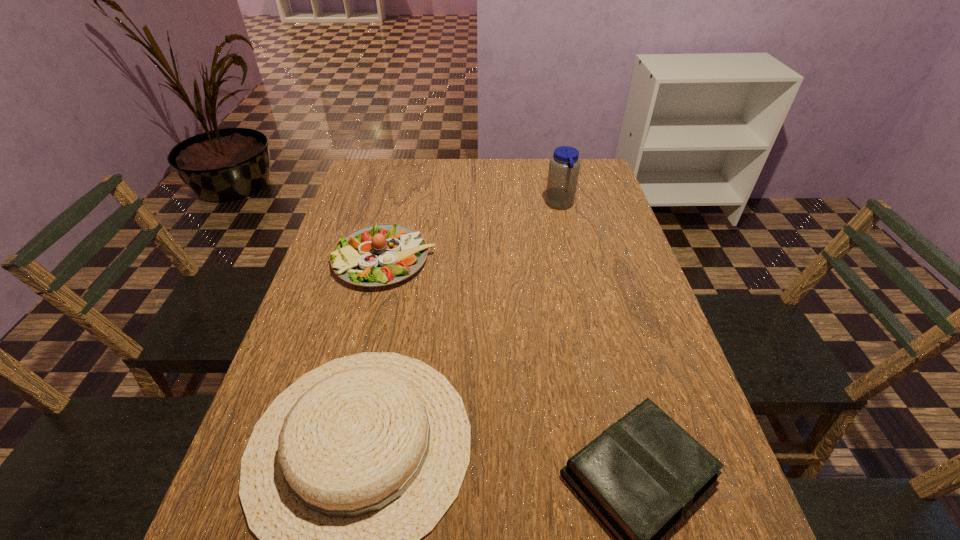
This screenshot has width=960, height=540. I want to click on free space at the left edge, so click(x=338, y=282).

You are a GUI agent. You are given a task and a screenshot of the screen. Output one action in this format:
    pyautogui.click(x=<x>, y=<y>)
    Task: Click on the vacant space at the right edge
    This screenshot has width=960, height=540.
    Given the screenshot: What is the action you would take?
    pyautogui.click(x=607, y=356)

Where is `free space at the far right corner`? This screenshot has height=540, width=960. free space at the far right corner is located at coordinates (605, 183).

You are a GUI agent. You are given a task and a screenshot of the screen. Output one action in this format:
    pyautogui.click(x=<x>, y=<y>)
    Task: Click on the free space between the water bottle and the second farthest object
    The height and width of the screenshot is (540, 960).
    Given the screenshot: What is the action you would take?
    pyautogui.click(x=472, y=232)

Locate an element on the screen. The width and height of the screenshot is (960, 540). free space between the water bottle and the salad plate is located at coordinates (472, 232).

The height and width of the screenshot is (540, 960). I want to click on empty location between the third nearest object and the water bottle, so click(472, 232).

Point out which object is positioned as the second nearest to the second farthest object. Please provide its 2D coordinates. Your answer should be formatted as a tuple, i.e. [(x, y)], where the tuple contains the x and y coordinates of a point satisfying the conditions above.

[(564, 165)]

You are a GUI agent. You are given a task and a screenshot of the screen. Output one action in this format:
    pyautogui.click(x=<x>, y=<y>)
    Task: Click on the object that stands as the closest to the shortest object
    The width and height of the screenshot is (960, 540).
    Given the screenshot: What is the action you would take?
    pyautogui.click(x=353, y=464)